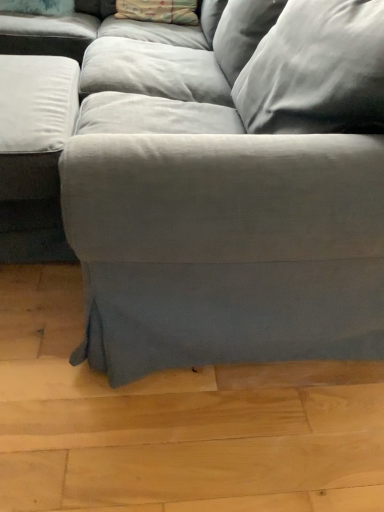
Question: Is fluffy white pillow at upper left, which ranks as the 2th pillow in right-to-left order, wider than patterned fabric pillow at upper center, which appears as the first pillow when viewed from the right?

Choices:
 (A) yes
 (B) no

Answer: (B)

Question: Is fluffy white pillow at upper left, which ranks as the 2th pillow in right-to-left order, not near patterned fabric pillow at upper center, the second pillow from the left?

Choices:
 (A) yes
 (B) no

Answer: (B)

Question: Is fluffy white pillow at upper left, which ranks as the 2th pillow in right-to-left order, positioned in front of patterned fabric pillow at upper center, which appears as the first pillow when viewed from the right?

Choices:
 (A) no
 (B) yes

Answer: (B)

Question: Considering the relative sizes of fluffy white pillow at upper left, the 1th pillow positioned from the left, and patterned fabric pillow at upper center, which appears as the first pillow when viewed from the right, in the image provided, is fluffy white pillow at upper left, the 1th pillow positioned from the left, smaller than patterned fabric pillow at upper center, which appears as the first pillow when viewed from the right,?

Choices:
 (A) no
 (B) yes

Answer: (B)

Question: Is fluffy white pillow at upper left, the 1th pillow positioned from the left, not inside patterned fabric pillow at upper center, the second pillow from the left?

Choices:
 (A) yes
 (B) no

Answer: (A)

Question: Could you tell me if fluffy white pillow at upper left, the 1th pillow positioned from the left, is facing patterned fabric pillow at upper center, the second pillow from the left?

Choices:
 (A) no
 (B) yes

Answer: (A)

Question: From a real-world perspective, is patterned fabric pillow at upper center, the second pillow from the left, below fluffy white pillow at upper left, which ranks as the 2th pillow in right-to-left order?

Choices:
 (A) yes
 (B) no

Answer: (B)

Question: Can you confirm if patterned fabric pillow at upper center, which appears as the first pillow when viewed from the right, is taller than fluffy white pillow at upper left, which ranks as the 2th pillow in right-to-left order?

Choices:
 (A) yes
 (B) no

Answer: (A)

Question: From a real-world perspective, does patterned fabric pillow at upper center, which appears as the first pillow when viewed from the right, stand above fluffy white pillow at upper left, the 1th pillow positioned from the left?

Choices:
 (A) no
 (B) yes

Answer: (B)

Question: Is patterned fabric pillow at upper center, the second pillow from the left, at the right side of fluffy white pillow at upper left, the 1th pillow positioned from the left?

Choices:
 (A) no
 (B) yes

Answer: (B)

Question: Is patterned fabric pillow at upper center, which appears as the first pillow when viewed from the right, shorter than fluffy white pillow at upper left, the 1th pillow positioned from the left?

Choices:
 (A) no
 (B) yes

Answer: (A)

Question: Is patterned fabric pillow at upper center, which appears as the first pillow when viewed from the right, outside of fluffy white pillow at upper left, which ranks as the 2th pillow in right-to-left order?

Choices:
 (A) no
 (B) yes

Answer: (B)

Question: Does point (193, 4) appear closer or farther from the camera than point (56, 3)?

Choices:
 (A) farther
 (B) closer

Answer: (B)